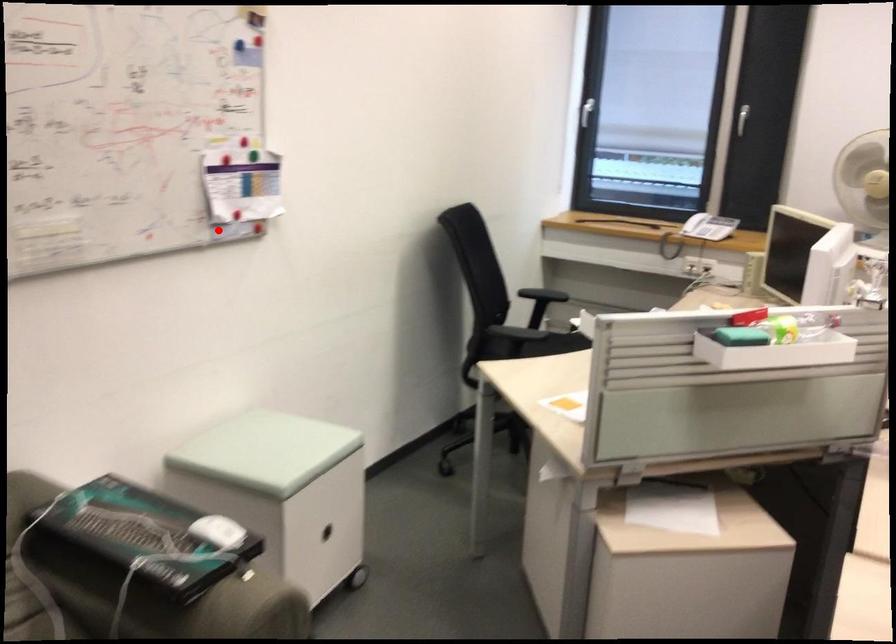
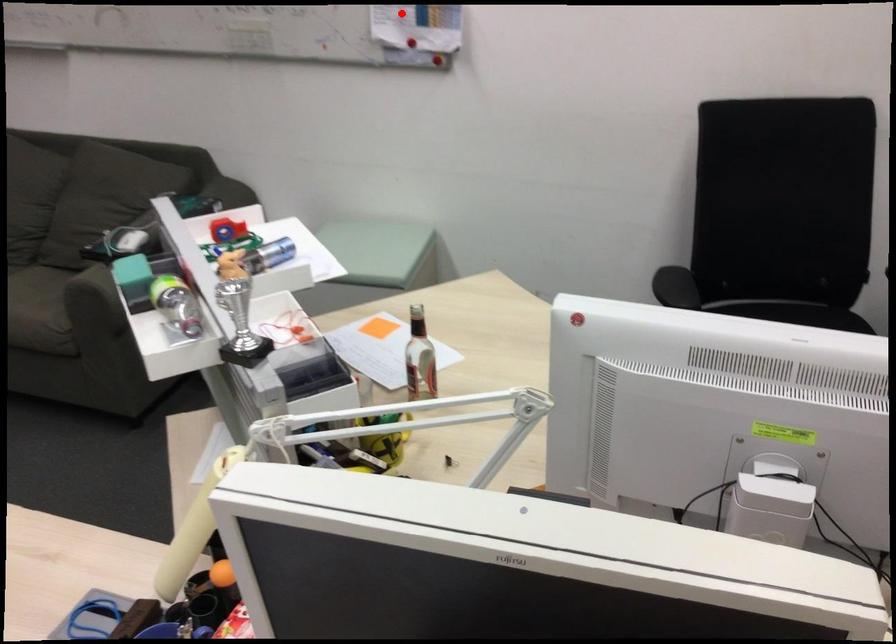
Based on the photo, I am providing you with two images of the same scene from different viewpoints. A red point is marked on the first image and another point is marked on the second image. Is the marked point in image1 the same physical position as the marked point in image2?

No